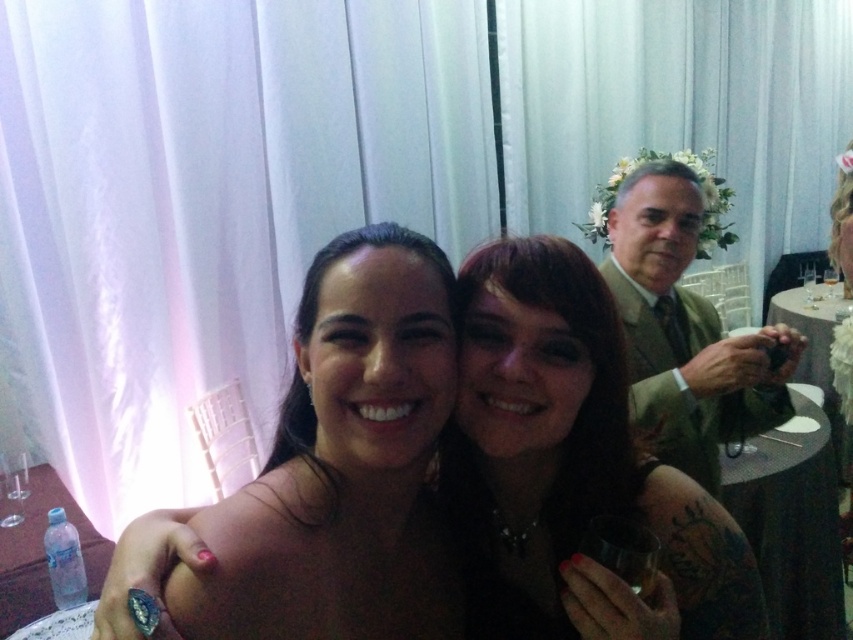
You are standing at the center of the image and want to move towards the two points marked in the scene. Which point, point (x=773, y=612) or point (x=97, y=582), would you reach first?

You would reach point (x=97, y=582) first because it is closer to you than point (x=773, y=612), which is further away.

You are a photographer at a formal event and need to place a small decoration at the exact location of the transparent glass at lower left. According to the scene coordinates, where should you place it?

The transparent glass at lower left should be placed at point coordinates of (12, 488).